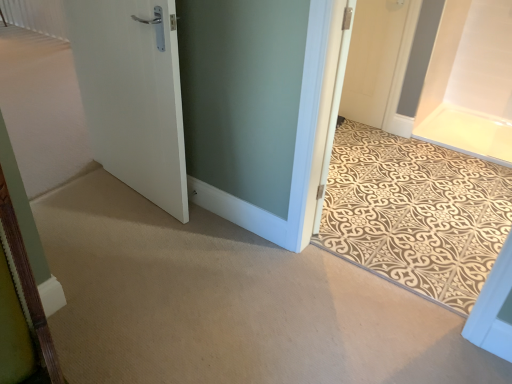
Question: Is white matte door at upper right, marked as the 3th door in a left-to-right arrangement, outside white matte door at left, arranged as the 1th door when viewed from the left?

Choices:
 (A) yes
 (B) no

Answer: (A)

Question: Is white matte door at left, marked as the 2th door in a front-to-back arrangement, a part of white matte door at upper right, acting as the 1th door starting from the back?

Choices:
 (A) yes
 (B) no

Answer: (B)

Question: Can you confirm if white matte door at upper right, which is the 1th door from right to left, is positioned to the right of white matte door at left, the 3th door from the right?

Choices:
 (A) yes
 (B) no

Answer: (A)

Question: Considering the relative sizes of white matte door at upper right, acting as the 1th door starting from the back, and white matte door at left, marked as the 2th door in a front-to-back arrangement, in the image provided, is white matte door at upper right, acting as the 1th door starting from the back, wider than white matte door at left, marked as the 2th door in a front-to-back arrangement,?

Choices:
 (A) no
 (B) yes

Answer: (A)

Question: Is white matte door at upper right, marked as the 3th door in a left-to-right arrangement, positioned with its back to white matte door at left, the 3th door from the right?

Choices:
 (A) yes
 (B) no

Answer: (B)

Question: Is point (148, 165) positioned closer to the camera than point (105, 56)?

Choices:
 (A) closer
 (B) farther

Answer: (B)

Question: Based on their sizes in the image, would you say white matte door at left, positioned as the second door in right-to-left order, is bigger or smaller than white matte door at left, the 3th door from the right?

Choices:
 (A) big
 (B) small

Answer: (B)

Question: Based on their positions, is white matte door at left, positioned as the second door in right-to-left order, located to the left or right of white matte door at left, arranged as the 1th door when viewed from the left?

Choices:
 (A) right
 (B) left

Answer: (A)

Question: From a real-world perspective, is white matte door at left, marked as the 1th door in a front-to-back arrangement, physically located above or below white matte door at left, marked as the 2th door in a front-to-back arrangement?

Choices:
 (A) above
 (B) below

Answer: (A)

Question: Is beige patterned mat at center situated inside white matte door at left, arranged as the 1th door when viewed from the left, or outside?

Choices:
 (A) inside
 (B) outside

Answer: (B)

Question: Is beige patterned mat at center bigger or smaller than white matte door at left, the 3th door from the right?

Choices:
 (A) small
 (B) big

Answer: (A)

Question: Is point (443, 264) positioned closer to the camera than point (244, 223)?

Choices:
 (A) farther
 (B) closer

Answer: (B)

Question: In the image, is beige patterned mat at center on the left side or the right side of white matte door at left, marked as the 2th door in a front-to-back arrangement?

Choices:
 (A) left
 (B) right

Answer: (B)

Question: Relative to white matte door at upper right, which is the 1th door from right to left, is white matte door at left, acting as the 3th door starting from the back, in front or behind?

Choices:
 (A) front
 (B) behind

Answer: (A)

Question: Considering the positions of white matte door at left, marked as the 1th door in a front-to-back arrangement, and white matte door at upper right, marked as the 3th door in a left-to-right arrangement, in the image, is white matte door at left, marked as the 1th door in a front-to-back arrangement, bigger or smaller than white matte door at upper right, marked as the 3th door in a left-to-right arrangement,?

Choices:
 (A) small
 (B) big

Answer: (B)